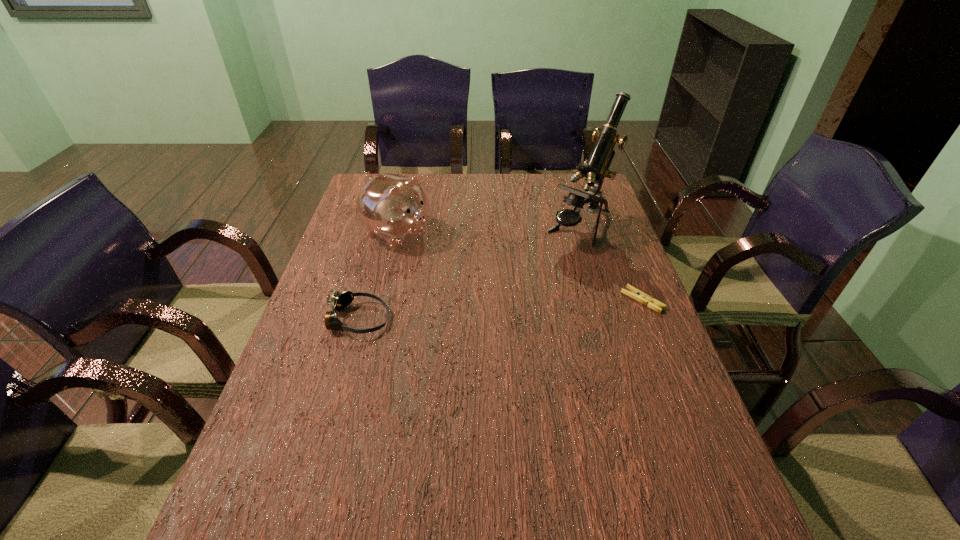
Where is `the second shortest object`? The width and height of the screenshot is (960, 540). the second shortest object is located at coordinates (339, 301).

This screenshot has width=960, height=540. I want to click on clothespin, so click(636, 294).

Where is `the second tallest object`? The image size is (960, 540). the second tallest object is located at coordinates (394, 207).

At what (x,y) coordinates should I click in order to perform the action: click on the tallest object. Please return your answer as a coordinate pair (x, y). The width and height of the screenshot is (960, 540). Looking at the image, I should click on (596, 168).

You are a GUI agent. You are given a task and a screenshot of the screen. Output one action in this format:
    pyautogui.click(x=<x>, y=<y>)
    Task: Click on the vacant point located through the lenses of the third tallest object
    
    Given the screenshot: What is the action you would take?
    pyautogui.click(x=441, y=320)

Locate an element on the screen. This screenshot has height=540, width=960. vacant space located on the left of the shortest object is located at coordinates (594, 300).

Where is `free location located 0.060m on the front facing side of the piggy bank`? The width and height of the screenshot is (960, 540). free location located 0.060m on the front facing side of the piggy bank is located at coordinates (437, 253).

Locate an element on the screen. Image resolution: width=960 pixels, height=540 pixels. vacant space located on the front facing side of the piggy bank is located at coordinates (528, 299).

Find the location of `vacant area situated on the front facing side of the piggy bank`. vacant area situated on the front facing side of the piggy bank is located at coordinates (528, 299).

Locate an element on the screen. This screenshot has height=540, width=960. free space located through the eyepiece of the microscope is located at coordinates (522, 284).